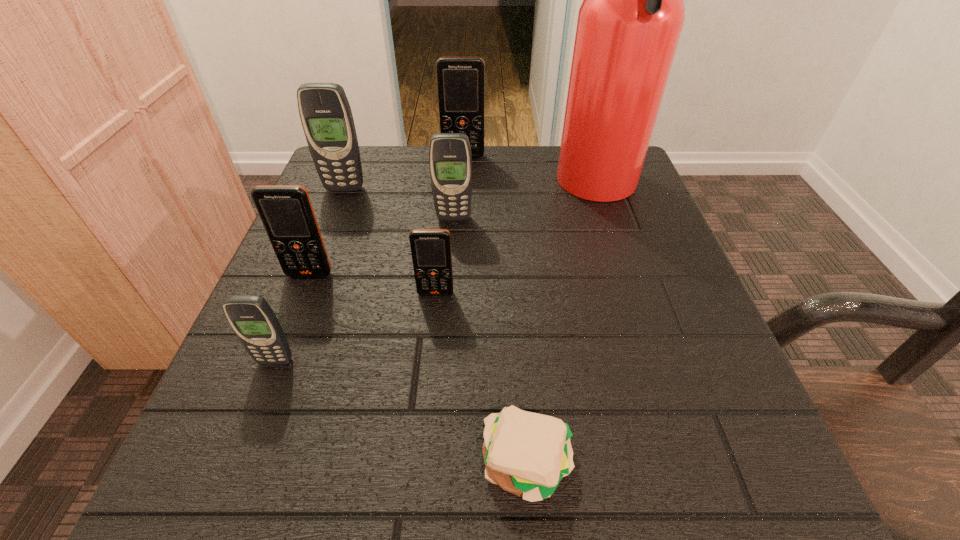
Where is `vacant area situated on the screen of the second smallest orange cellular telephone`? Image resolution: width=960 pixels, height=540 pixels. vacant area situated on the screen of the second smallest orange cellular telephone is located at coordinates (284, 339).

Where is `blank space located on the screen of the third nearest object`? blank space located on the screen of the third nearest object is located at coordinates (433, 325).

You are a GUI agent. You are given a task and a screenshot of the screen. Output one action in this format:
    pyautogui.click(x=<x>, y=<y>)
    Task: Click on the free space located on the screen of the seventh farthest object
    
    Given the screenshot: What is the action you would take?
    click(219, 507)

At what (x,y) coordinates should I click in order to perform the action: click on free spot located on the right of the nearest object. Please return your answer as a coordinate pair (x, y). The height and width of the screenshot is (540, 960). Looking at the image, I should click on (613, 464).

Where is `fire extinguisher that is at the far edge`? The height and width of the screenshot is (540, 960). fire extinguisher that is at the far edge is located at coordinates (629, 24).

The height and width of the screenshot is (540, 960). I want to click on object present at the near edge, so click(x=527, y=454).

Locate an element on the screen. object at the right edge is located at coordinates (629, 24).

Locate an element on the screen. object at the far left corner is located at coordinates (326, 116).

Identify the location of object at the far right corner. (629, 24).

This screenshot has height=540, width=960. What are the coordinates of `free region at the far edge of the desktop` in the screenshot? It's located at (477, 198).